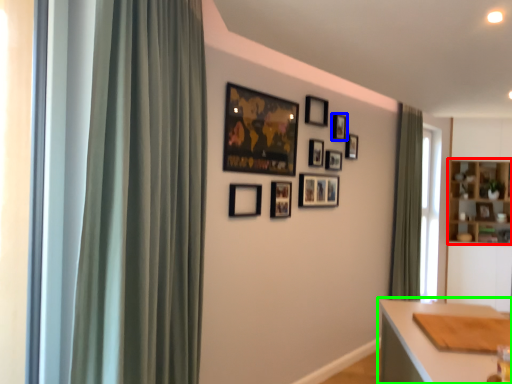
Question: Which object is the closest to the cabinetry (highlighted by a red box)? Choose among these: picture frame (highlighted by a blue box) or table (highlighted by a green box).

Choices:
 (A) picture frame
 (B) table

Answer: (A)